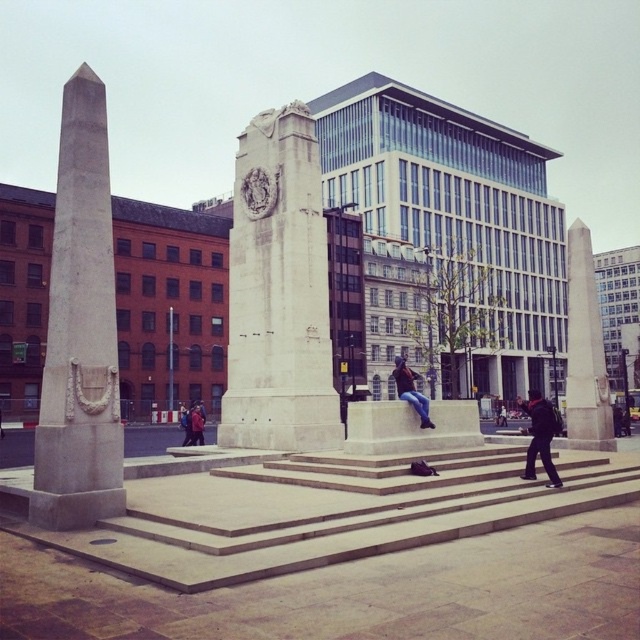
Is white marble obelisk at left taller than dark blue jeans at lower right?

Yes, white marble obelisk at left is taller than dark blue jeans at lower right.

Can you confirm if white marble obelisk at left is wider than dark blue jeans at lower right?

In fact, white marble obelisk at left might be narrower than dark blue jeans at lower right.

Is point (115, 515) farther from camera compared to point (540, 397)?

That is False.

Locate an element on the screen. This screenshot has height=640, width=640. white marble obelisk at left is located at coordinates (80, 330).

Does dark blue jeans at lower right have a larger size compared to denim jeans at center?

Indeed, dark blue jeans at lower right has a larger size compared to denim jeans at center.

Who is positioned more to the left, dark blue jeans at lower right or denim jeans at center?

From the viewer's perspective, denim jeans at center appears more on the left side.

Which is behind, point (545, 422) or point (397, 387)?

The point (397, 387) is behind.

I want to click on dark blue jeans at lower right, so click(540, 436).

Between point (84, 276) and point (186, 412), which one is positioned behind?

Positioned behind is point (186, 412).

Between point (90, 518) and point (200, 424), which one is positioned in front?

Point (90, 518)

At what (x,y) coordinates should I click in order to perform the action: click on white marble obelisk at left. Please return your answer as a coordinate pair (x, y). Looking at the image, I should click on (80, 330).